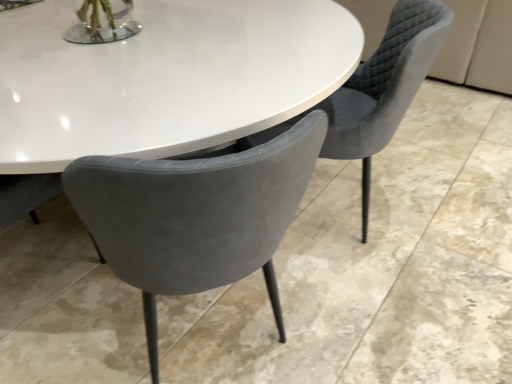
Where is `vacant region under matte gray chair at center, the 1th chair from the left (from a real-world perspective)`? vacant region under matte gray chair at center, the 1th chair from the left (from a real-world perspective) is located at coordinates (219, 337).